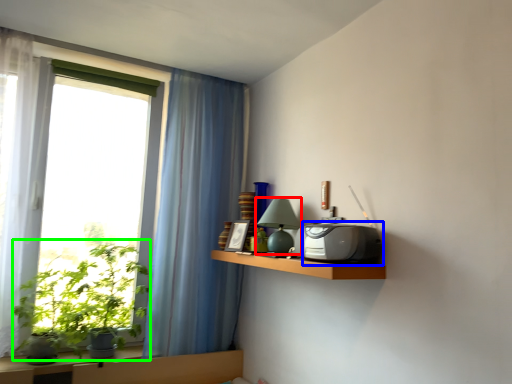
Question: Considering the real-world distances, which object is closest to table lamp (highlighted by a red box)? appliance (highlighted by a blue box) or plant (highlighted by a green box).

Choices:
 (A) appliance
 (B) plant

Answer: (A)